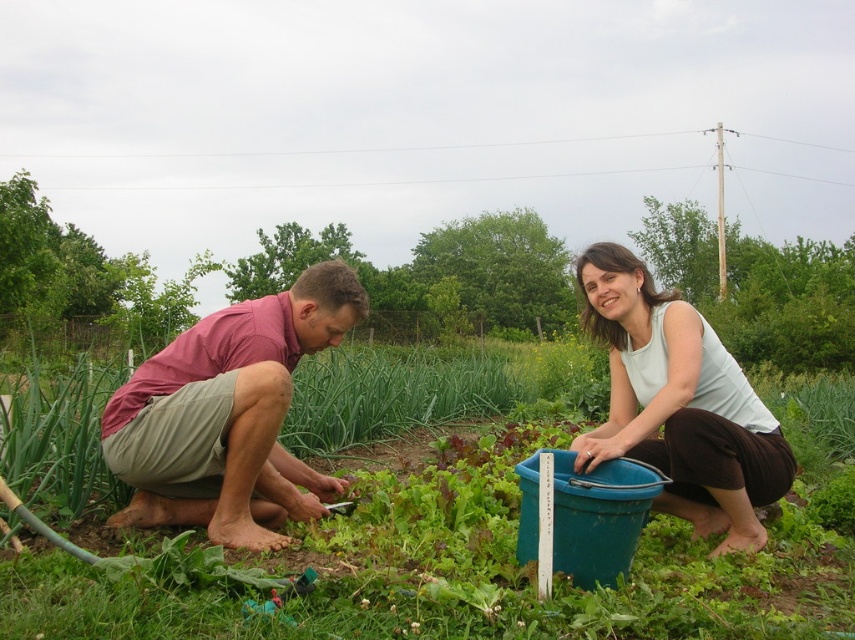
Question: Which object is the farthest from the green leafy vegetables at center?

Choices:
 (A) pink textured shirt at center
 (B) white matte tank top at center

Answer: (A)

Question: Which object appears farthest from the camera in this image?

Choices:
 (A) green leafy vegetables at center
 (B) white matte tank top at center
 (C) pink textured shirt at center

Answer: (B)

Question: Does green leafy vegetables at center appear on the left side of white matte tank top at center?

Choices:
 (A) no
 (B) yes

Answer: (B)

Question: Which point appears farthest from the camera in this image?

Choices:
 (A) (193, 465)
 (B) (575, 429)
 (C) (681, 388)

Answer: (B)

Question: Is green leafy vegetables at center smaller than pink textured shirt at center?

Choices:
 (A) no
 (B) yes

Answer: (A)

Question: Is green leafy vegetables at center above white matte tank top at center?

Choices:
 (A) yes
 (B) no

Answer: (A)